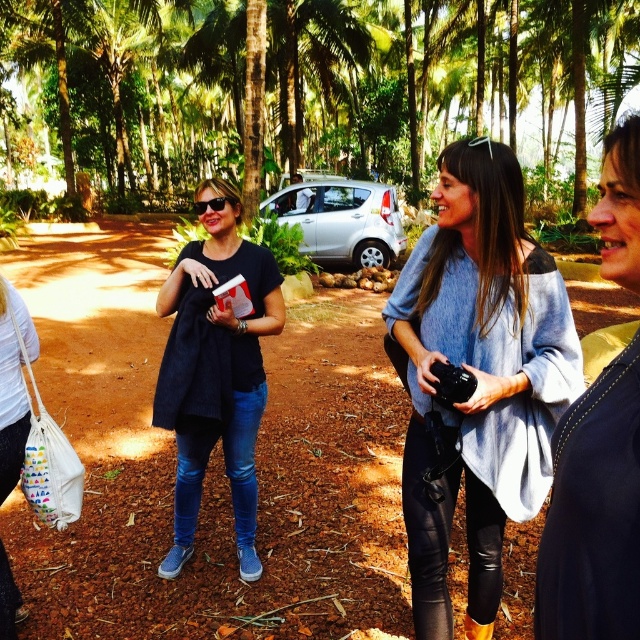
Question: Observing the image, what is the correct spatial positioning of green leafy tree at center in reference to black matte t-shirt at center?

Choices:
 (A) above
 (B) below

Answer: (A)

Question: Does light blue sweater at center have a lesser width compared to denim jacket at center?

Choices:
 (A) yes
 (B) no

Answer: (B)

Question: Can you confirm if light blue sweater at center is wider than black matte t-shirt at center?

Choices:
 (A) yes
 (B) no

Answer: (B)

Question: Which point is closer to the camera?

Choices:
 (A) click(173, 417)
 (B) click(570, 618)
 (C) click(13, 20)
 (D) click(417, 445)

Answer: (B)

Question: Which point is closer to the camera?

Choices:
 (A) green leafy tree at center
 (B) denim jacket at center
 (C) light blue sweater at center
 (D) black matte t-shirt at center

Answer: (B)

Question: Which of the following is the closest to the observer?

Choices:
 (A) (589, 582)
 (B) (237, 432)

Answer: (A)